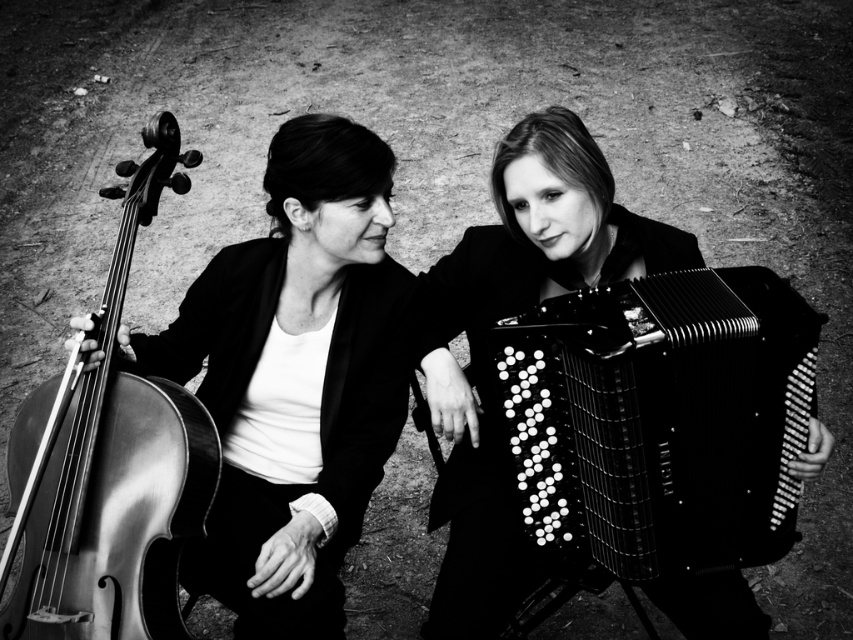
Is shiny black cello at left to the left of shiny wood violin at left from the viewer's perspective?

In fact, shiny black cello at left is to the right of shiny wood violin at left.

Can you confirm if shiny black cello at left is positioned above shiny wood violin at left?

No.

The width and height of the screenshot is (853, 640). Describe the element at coordinates (296, 380) in the screenshot. I see `shiny black cello at left` at that location.

Locate an element on the screen. shiny black cello at left is located at coordinates (296, 380).

Which is in front, point (328, 524) or point (500, 384)?

Point (500, 384) is in front.

Who is lower down, shiny black cello at left or black matte accordion at center?

black matte accordion at center is below.

Image resolution: width=853 pixels, height=640 pixels. What do you see at coordinates (296, 380) in the screenshot? I see `shiny black cello at left` at bounding box center [296, 380].

Where is `shiny black cello at left`? The width and height of the screenshot is (853, 640). shiny black cello at left is located at coordinates [x=296, y=380].

Is black matte accordion at center bigger than shiny wood violin at left?

Actually, black matte accordion at center might be smaller than shiny wood violin at left.

Is black matte accordion at center to the right of shiny wood violin at left from the viewer's perspective?

Yes, black matte accordion at center is to the right of shiny wood violin at left.

Who is more distant from viewer, (527, 432) or (149, 184)?

The point (149, 184) is more distant.

This screenshot has height=640, width=853. In order to click on black matte accordion at center in this screenshot , I will do `click(659, 419)`.